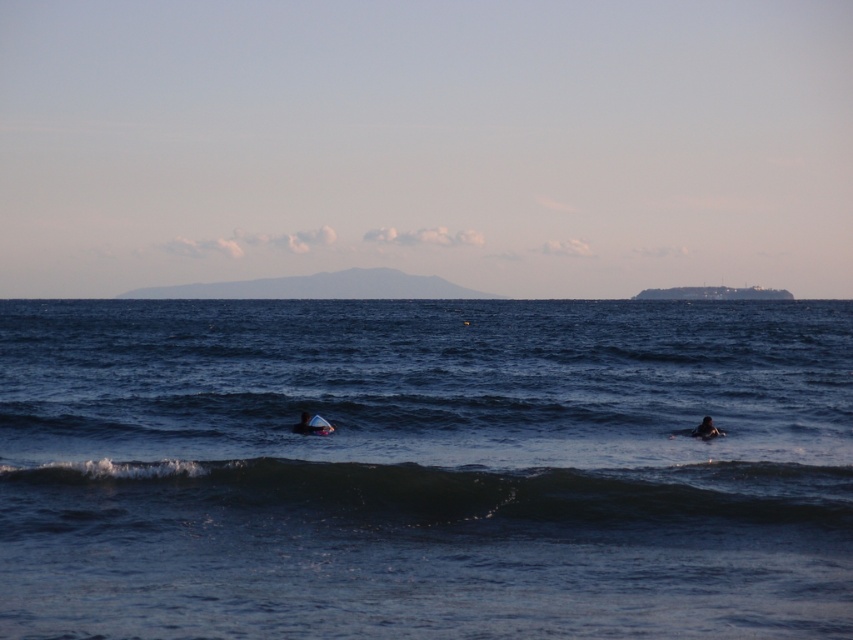
You are standing on the beach and see the dark blue water at lower center and the dark blue wetsuit at lower right. Which object is closer to the horizon?

The dark blue wetsuit at lower right is closer to the horizon because it has a greater height compared to the dark blue water at lower center.

You are standing on the beach and see the dark blue water at lower center and the dark blue wetsuit at lower right. Which object is nearer to you?

The dark blue water at lower center is closer to the viewer than the dark blue wetsuit at lower right.